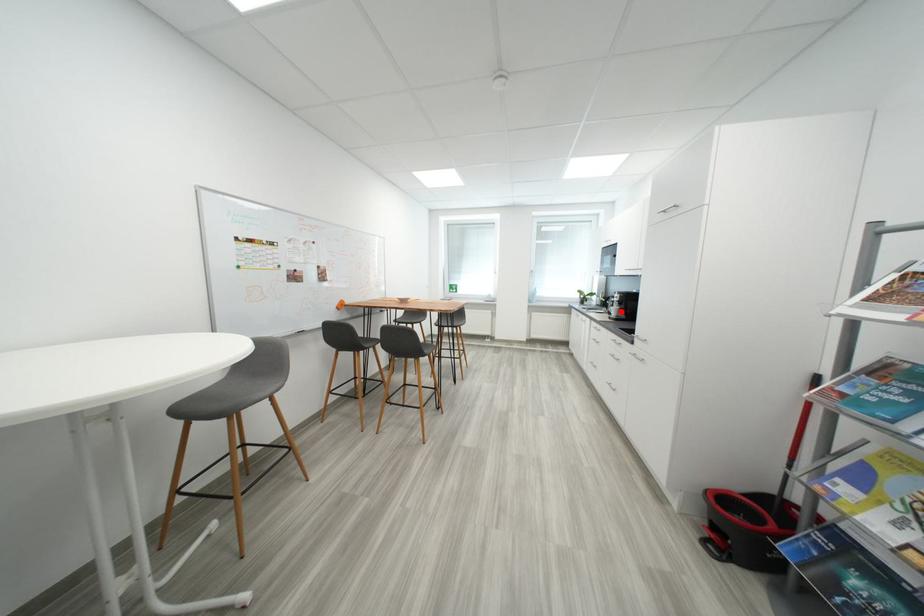
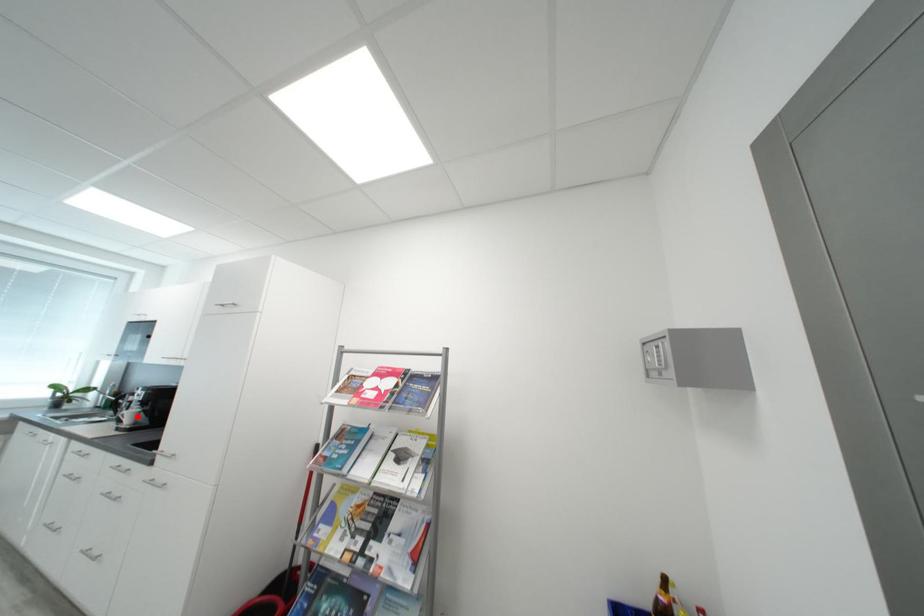
I am providing you with two images of the same scene from different viewpoints. A red point is marked on the first image and another point is marked on the second image. Does the point marked in image1 correspond to the same location as the one in image2?

Yes